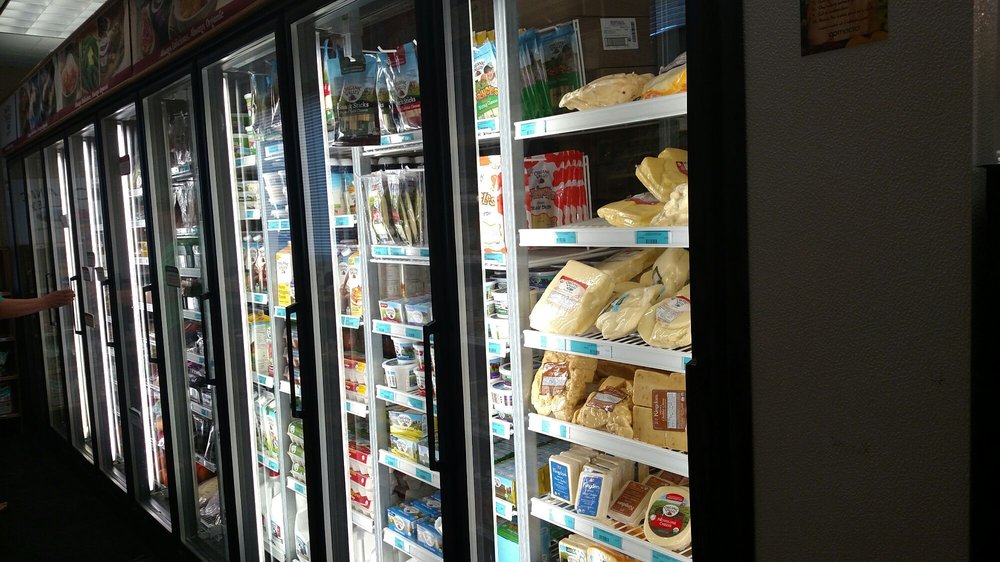
The height and width of the screenshot is (562, 1000). Identify the location of floor. (59, 498).